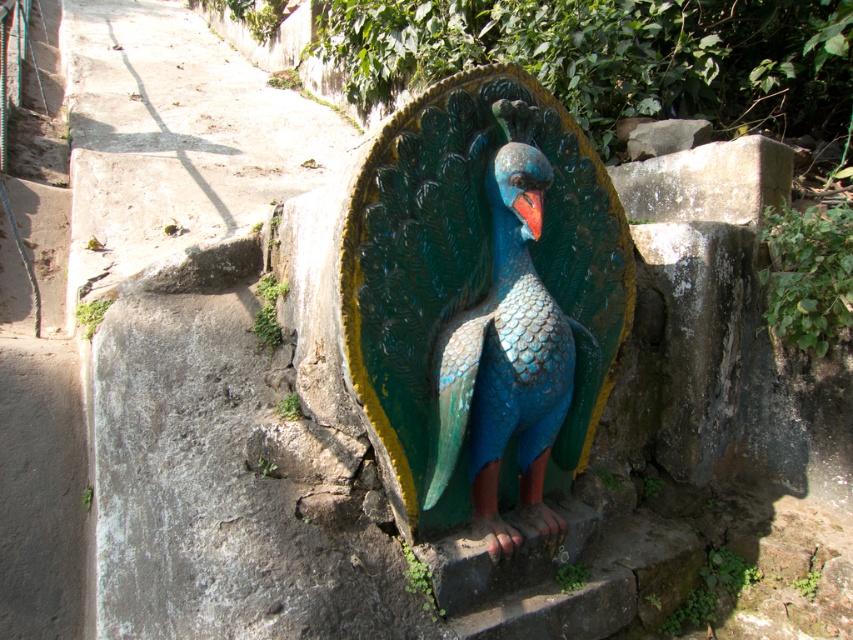
Is point (488, 120) positioned after point (538, 198)?

Yes, it is behind point (538, 198).

Does shiny painted peacock at center have a greater height compared to shiny red beak at center?

Yes.

Is point (579, 378) positioned behind point (527, 205)?

Yes, it is behind point (527, 205).

At what (x,y) coordinates should I click in order to perform the action: click on shiny painted peacock at center. Please return your answer as a coordinate pair (x, y). This screenshot has height=640, width=853. Looking at the image, I should click on (480, 296).